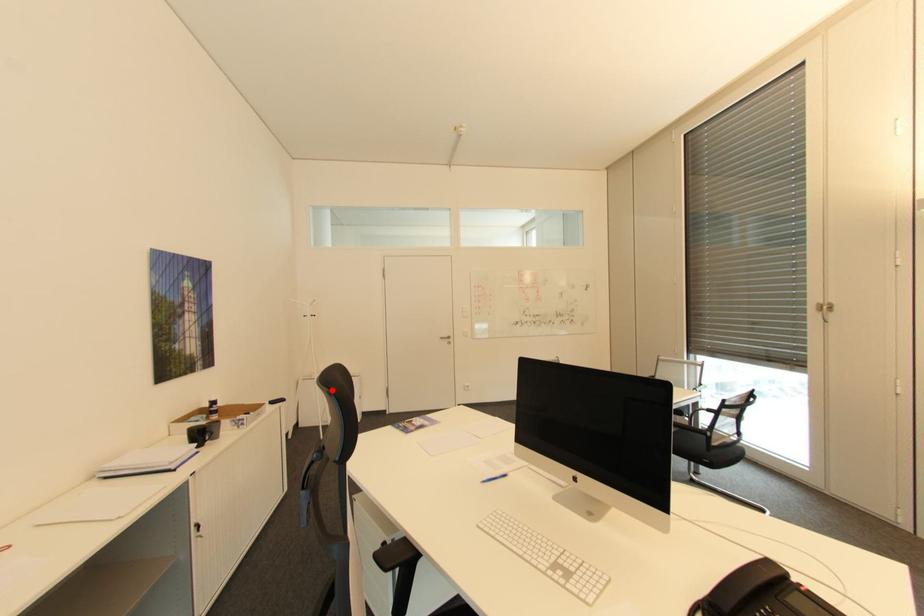
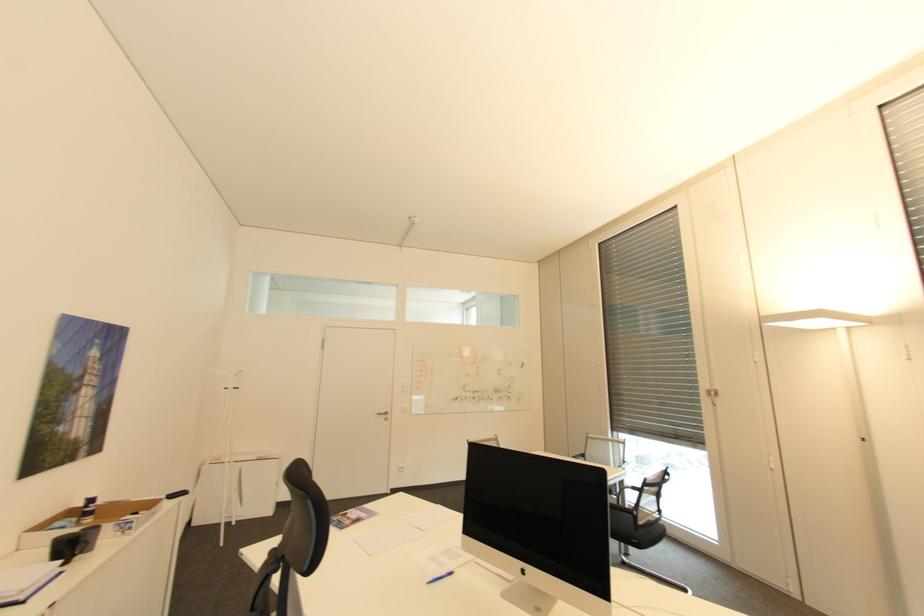
The point at the highlighted location is marked in the first image. Where is the corresponding point in the second image?

(306, 492)